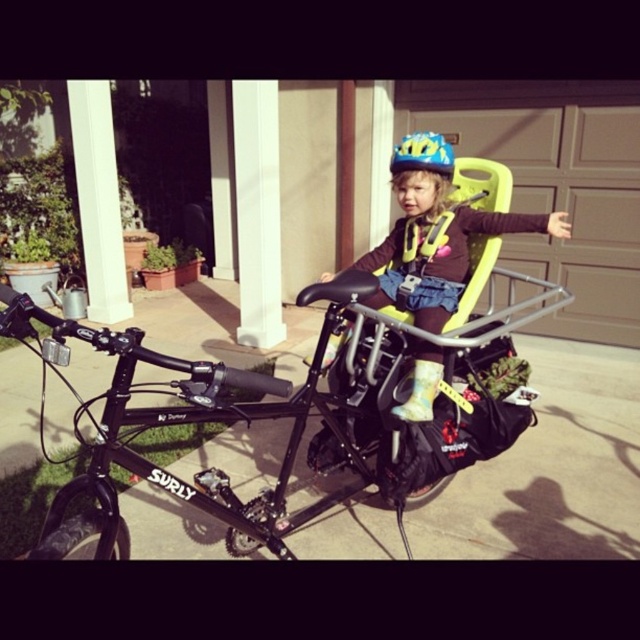
You are a photographer trying to capture the child in the matte yellow helmet at center while ensuring the black matte surly bike at center is visible in the frame. Based on their positions, which object should you focus on first to include both in the shot?

The black matte surly bike at center is positioned on the left side of the matte yellow helmet at center. To include both in the frame, focus on the black matte surly bike at center first since it is closer to the left edge, allowing the matte yellow helmet at center to be captured on the right side of the frame.

Based on the scene description, where is the black matte Surly bike located? Please provide coordinates in the format of a point like (278, 413).

The black matte Surly bike at center is located at point (278, 413).